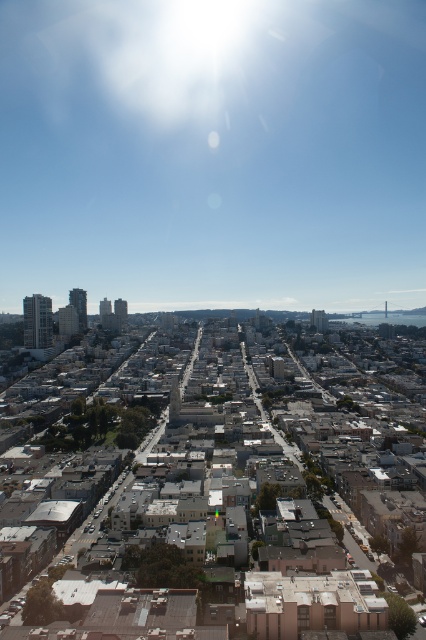
Question: Which point is closer to the camera taking this photo?

Choices:
 (A) (321, 621)
 (B) (411, 224)

Answer: (A)

Question: Which of the following is the farthest from the observer?

Choices:
 (A) (281, 424)
 (B) (138, 92)

Answer: (B)

Question: Is bright white sunlight at upper center to the left of gray concrete buildings at center from the viewer's perspective?

Choices:
 (A) no
 (B) yes

Answer: (B)

Question: Which object appears closest to the camera in this image?

Choices:
 (A) gray concrete buildings at center
 (B) bright white sunlight at upper center

Answer: (A)

Question: Is bright white sunlight at upper center closer to camera compared to gray concrete buildings at center?

Choices:
 (A) yes
 (B) no

Answer: (B)

Question: Does bright white sunlight at upper center appear under gray concrete buildings at center?

Choices:
 (A) yes
 (B) no

Answer: (B)